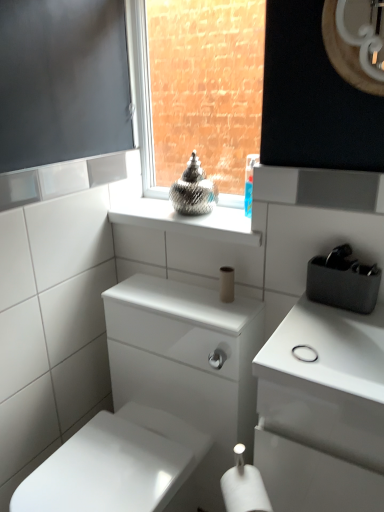
Question: Can you confirm if white matte toilet paper at lower center, which appears as the first toilet paper when viewed from the front, is thinner than glossy wood mirror at upper right?

Choices:
 (A) no
 (B) yes

Answer: (A)

Question: Is glossy wood mirror at upper right at the back of white matte toilet paper at lower center, placed as the first toilet paper when sorted from bottom to top?

Choices:
 (A) no
 (B) yes

Answer: (A)

Question: Is white matte toilet paper at lower center, marked as the second toilet paper in a top-to-bottom arrangement, to the left of glossy wood mirror at upper right from the viewer's perspective?

Choices:
 (A) yes
 (B) no

Answer: (A)

Question: Could glossy wood mirror at upper right be considered to be inside white matte toilet paper at lower center, placed as the first toilet paper when sorted from bottom to top?

Choices:
 (A) yes
 (B) no

Answer: (B)

Question: Is white matte toilet paper at lower center, placed as the first toilet paper when sorted from bottom to top, outside glossy wood mirror at upper right?

Choices:
 (A) no
 (B) yes

Answer: (B)

Question: Is matte glass vase at center spatially inside white matte toilet paper at lower center, which appears as the first toilet paper when viewed from the front, or outside of it?

Choices:
 (A) outside
 (B) inside

Answer: (A)

Question: Is point (139, 119) closer or farther from the camera than point (248, 499)?

Choices:
 (A) closer
 (B) farther

Answer: (B)

Question: In terms of height, does matte glass vase at center look taller or shorter compared to white matte toilet paper at lower center, marked as the second toilet paper in a top-to-bottom arrangement?

Choices:
 (A) short
 (B) tall

Answer: (B)

Question: From the image's perspective, is matte glass vase at center above or below white matte toilet paper at lower center, marked as the second toilet paper in a top-to-bottom arrangement?

Choices:
 (A) below
 (B) above

Answer: (B)

Question: Does point (220, 298) appear closer or farther from the camera than point (241, 377)?

Choices:
 (A) farther
 (B) closer

Answer: (A)

Question: From their relative heights in the image, would you say white matte toilet paper at center, acting as the first toilet paper starting from the top, is taller or shorter than white glossy porcelain at center?

Choices:
 (A) short
 (B) tall

Answer: (A)

Question: Do you think white matte toilet paper at center, acting as the first toilet paper starting from the top, is within white glossy porcelain at center, or outside of it?

Choices:
 (A) outside
 (B) inside

Answer: (A)

Question: Relative to white glossy porcelain at center, is white matte toilet paper at center, the second toilet paper in the front-to-back sequence, in front or behind?

Choices:
 (A) behind
 (B) front

Answer: (A)

Question: From a real-world perspective, relative to white matte toilet paper at lower center, placed as the first toilet paper when sorted from bottom to top, is white glossy porcelain at center vertically above or below?

Choices:
 (A) above
 (B) below

Answer: (B)

Question: Would you say white glossy porcelain at center is to the left or to the right of white matte toilet paper at lower center, marked as the second toilet paper in a top-to-bottom arrangement, in the picture?

Choices:
 (A) right
 (B) left

Answer: (B)